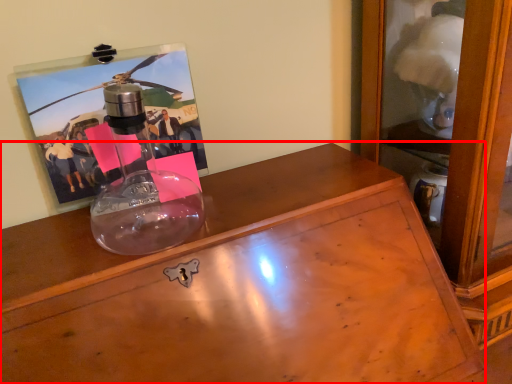
Question: From the image's perspective, considering the relative positions of desk (annotated by the red box) and picture frame in the image provided, where is desk (annotated by the red box) located with respect to the staircase?

Choices:
 (A) below
 (B) above

Answer: (A)